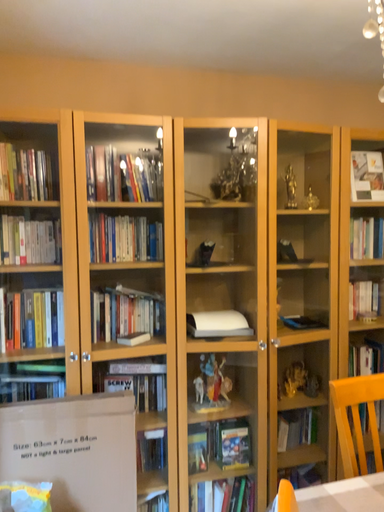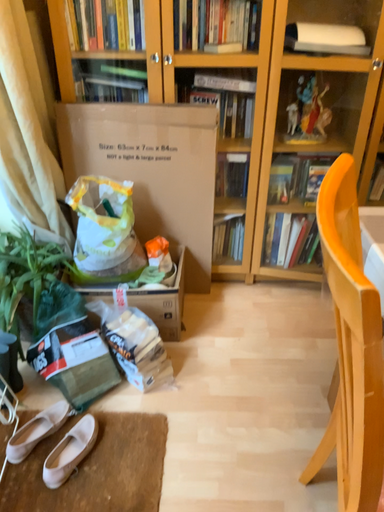
Question: How did the camera likely rotate when shooting the video?

Choices:
 (A) rotated downward
 (B) rotated upward

Answer: (A)